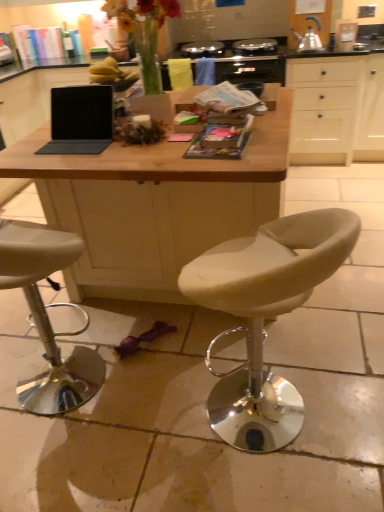
What are the coordinates of `free spot above matte paper magazine at center, which is counted as the 1th magazine, starting from the front (from a real-world perspective)` in the screenshot? It's located at (211, 143).